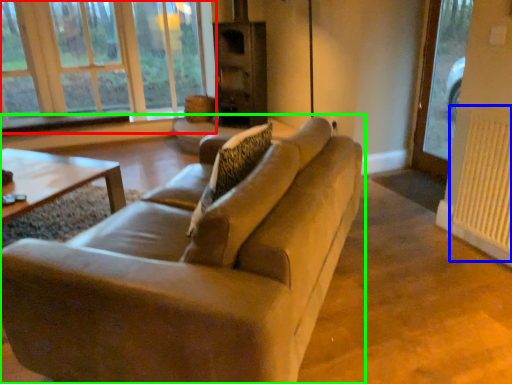
Question: Which object is positioned closest to window (highlighted by a red box)? Select from radiator (highlighted by a blue box) and studio couch (highlighted by a green box).

Choices:
 (A) radiator
 (B) studio couch

Answer: (B)